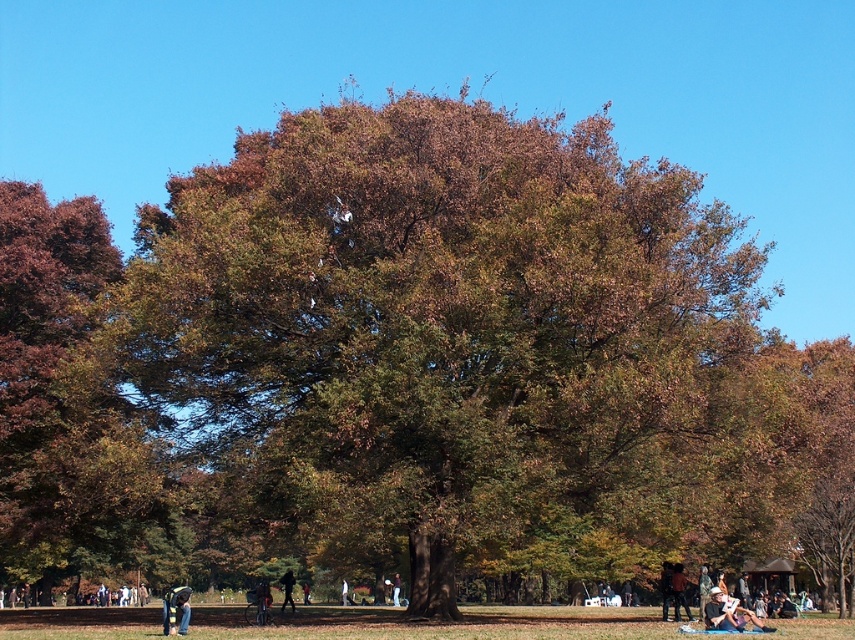
Is the position of brown dry grass at lower center less distant than that of dark brown leather jacket at lower right?

Yes, it is in front of dark brown leather jacket at lower right.

Can you confirm if brown dry grass at lower center is positioned below dark brown leather jacket at lower right?

Yes.

Describe the element at coordinates (438, 625) in the screenshot. I see `brown dry grass at lower center` at that location.

Identify the location of brown dry grass at lower center. The image size is (855, 640). (438, 625).

Is brown dry grass at lower center positioned at the back of light brown fabric at center?

No.

Measure the distance from brown dry grass at lower center to light brown fabric at center.

brown dry grass at lower center and light brown fabric at center are 10.45 meters apart from each other.

Locate an element on the screen. The height and width of the screenshot is (640, 855). brown dry grass at lower center is located at coordinates (438, 625).

Identify the location of brown dry grass at lower center. This screenshot has width=855, height=640. (438, 625).

Looking at this image, can you confirm if light brown fabric at center is shorter than dark blue jeans at center?

Yes, light brown fabric at center is shorter than dark blue jeans at center.

Where is `light brown fabric at center`? Image resolution: width=855 pixels, height=640 pixels. light brown fabric at center is located at coordinates (728, 614).